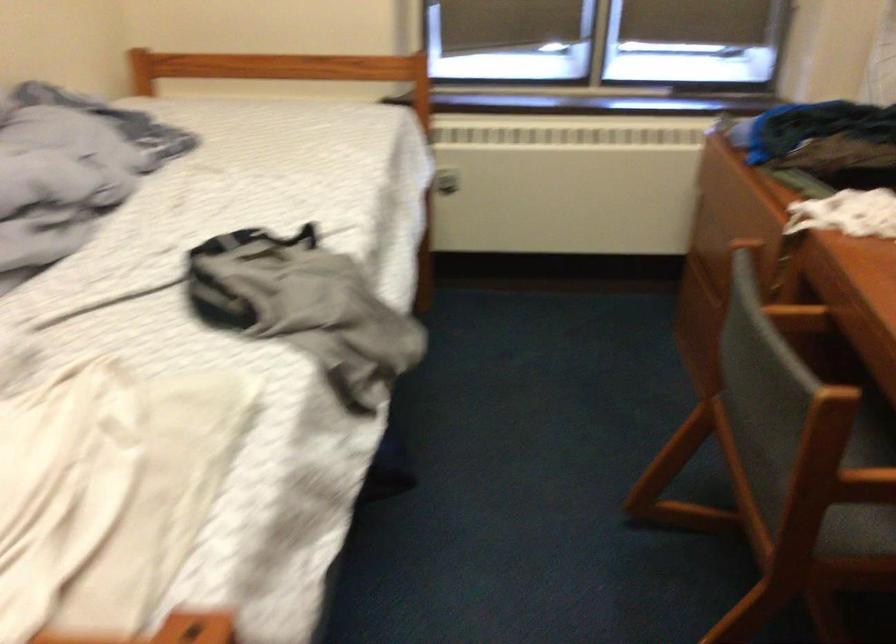
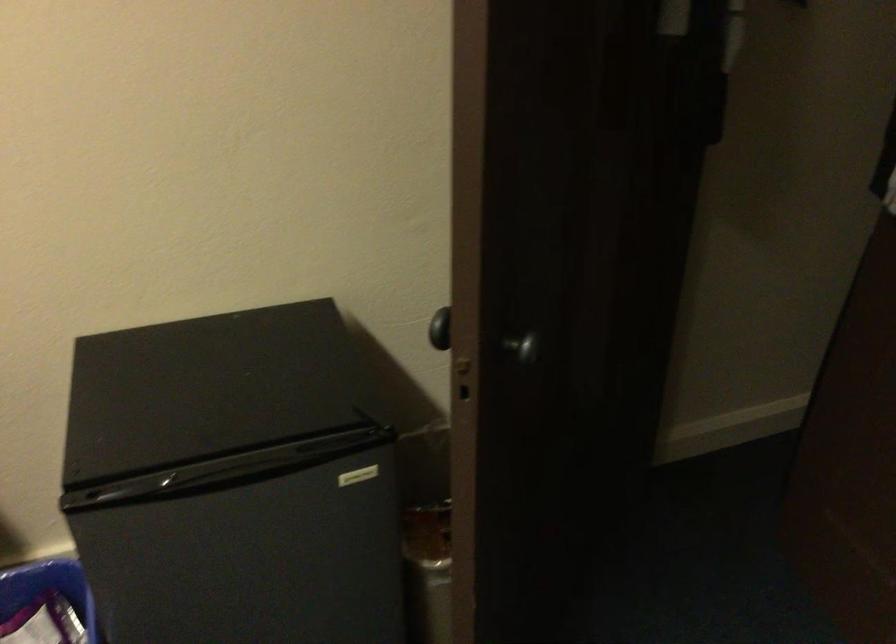
The images are taken continuously from a first-person perspective. In which direction is your viewpoint rotating?

The rotation direction of the camera is right-down.